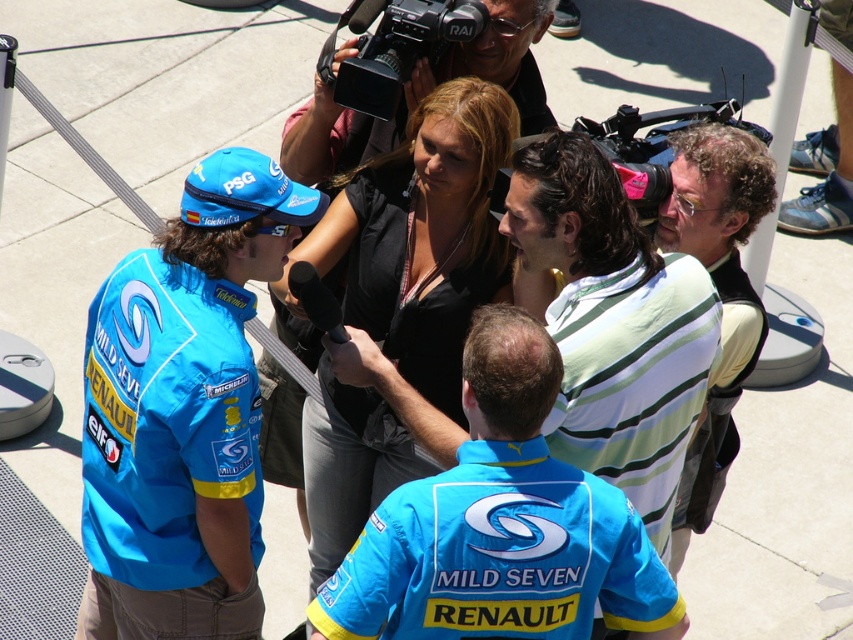
Question: Among these objects, which one is farthest from the camera?

Choices:
 (A) matte black camera at center
 (B) matte black camera at upper right
 (C) striped cotton shirt at center

Answer: (A)

Question: Which of the following is the closest to the observer?

Choices:
 (A) matte black camera at upper right
 (B) striped cotton shirt at center
 (C) matte blue jersey at left

Answer: (B)

Question: Can you confirm if black matte shirt at center is positioned to the left of black plastic video camera at upper center?

Choices:
 (A) no
 (B) yes

Answer: (B)

Question: Which point is closer to the camera taking this photo?

Choices:
 (A) (537, 408)
 (B) (126, 317)
 (C) (466, 32)

Answer: (A)

Question: Is blue jersey at center to the left of matte black camera at center from the viewer's perspective?

Choices:
 (A) no
 (B) yes

Answer: (A)

Question: Is black matte shirt at center positioned behind striped cotton shirt at center?

Choices:
 (A) yes
 (B) no

Answer: (A)